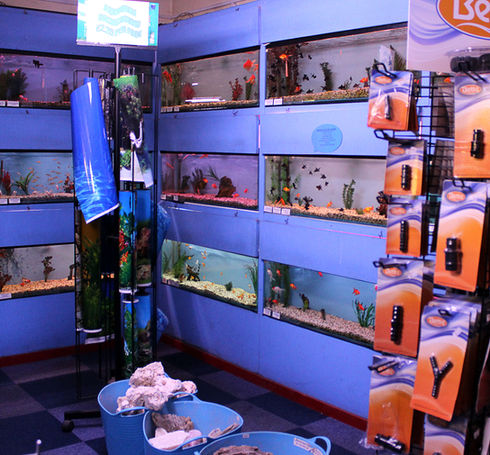
Locate an element on the screen. This screenshot has height=455, width=490. blue rubber bin is located at coordinates (284, 438), (224, 411), (107, 392).